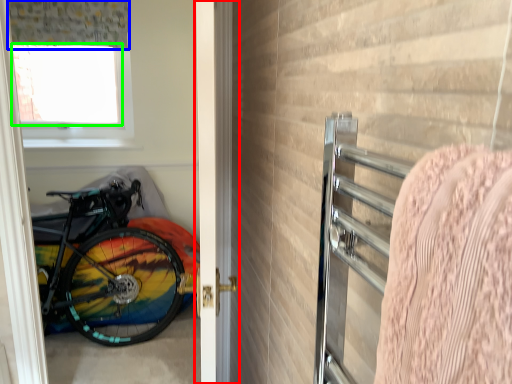
Question: Estimate the real-world distances between objects in this image. Which object is closer to door (highlighted by a red box), curtain (highlighted by a blue box) or window screen (highlighted by a green box)?

Choices:
 (A) curtain
 (B) window screen

Answer: (A)